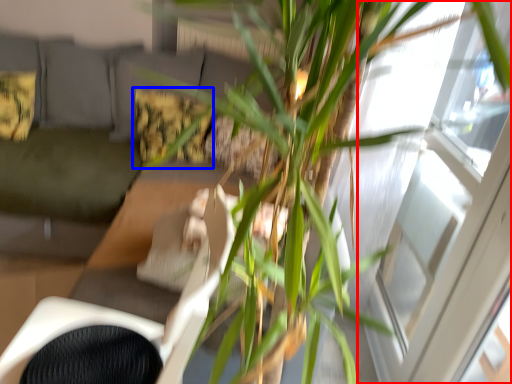
Question: Which object appears closest to the camera in this image, window (highlighted by a red box) or pillow (highlighted by a blue box)?

Choices:
 (A) window
 (B) pillow

Answer: (A)